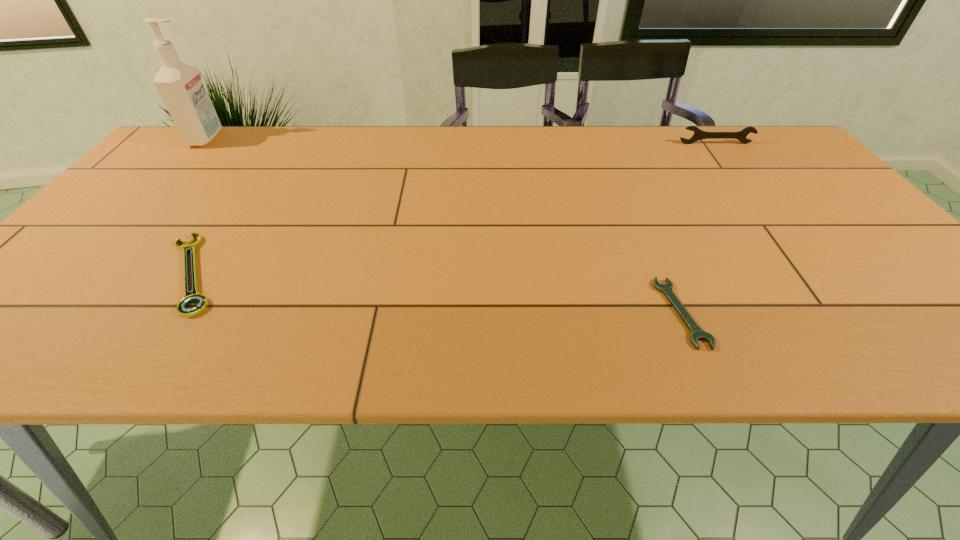
Find the location of a particular element. This screenshot has width=960, height=540. cleansing agent present at the far edge is located at coordinates [x=179, y=84].

You are a GUI agent. You are given a task and a screenshot of the screen. Output one action in this format:
    pyautogui.click(x=<x>, y=<y>)
    Task: Click on the wrench that is at the far edge
    
    Given the screenshot: What is the action you would take?
    pyautogui.click(x=698, y=134)

Find the location of `object located in the near edge section of the desktop`. object located in the near edge section of the desktop is located at coordinates (696, 333).

At what (x,y) coordinates should I click in order to perform the action: click on object that is positioned at the left edge. Please return your answer as a coordinate pair (x, y). The width and height of the screenshot is (960, 540). Looking at the image, I should click on (179, 84).

At what (x,y) coordinates should I click in order to perform the action: click on object at the right edge. Please return your answer as a coordinate pair (x, y). The image size is (960, 540). Looking at the image, I should click on (698, 134).

Image resolution: width=960 pixels, height=540 pixels. I want to click on object situated at the far left corner, so click(x=179, y=84).

Identify the location of object positioned at the far right corner. The image size is (960, 540). (698, 134).

Where is `vacant region at the far edge of the desktop`? The image size is (960, 540). vacant region at the far edge of the desktop is located at coordinates (513, 143).

Identify the location of vacant space at the near edge of the desktop. The image size is (960, 540). [158, 327].

At what (x,y) coordinates should I click in order to perform the action: click on free space at the far right corner. Please return your answer as a coordinate pair (x, y). This screenshot has width=960, height=540. Looking at the image, I should click on (764, 140).